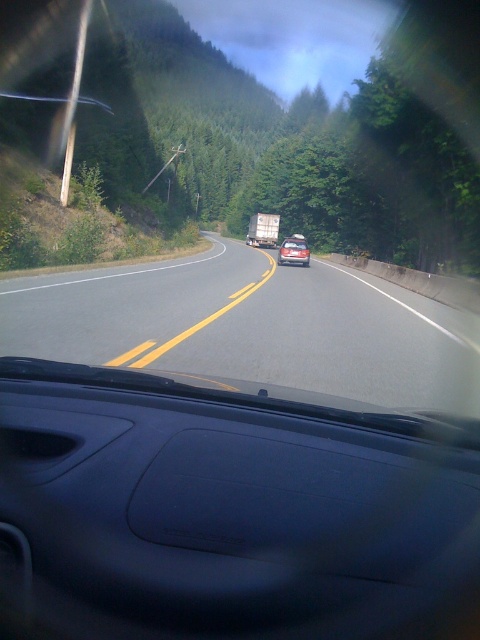
Question: From the image, what is the correct spatial relationship of transparent plastic car window at center in relation to green leafy tree at upper center?

Choices:
 (A) above
 (B) below

Answer: (B)

Question: Which of the following is the farthest from the observer?

Choices:
 (A) green leafy tree at upper center
 (B) smooth asphalt road at center
 (C) matte black sedan at center
 (D) metallic silver trailer truck at center

Answer: (D)

Question: Is smooth asphalt road at center above metallic silver trailer truck at center?

Choices:
 (A) yes
 (B) no

Answer: (B)

Question: Which object appears farthest from the camera in this image?

Choices:
 (A) metallic silver trailer truck at center
 (B) smooth asphalt road at center

Answer: (A)

Question: Which object appears farthest from the camera in this image?

Choices:
 (A) matte black sedan at center
 (B) green leafy tree at upper center
 (C) smooth asphalt road at center

Answer: (A)

Question: Can you confirm if smooth asphalt road at center is thinner than matte black sedan at center?

Choices:
 (A) no
 (B) yes

Answer: (A)